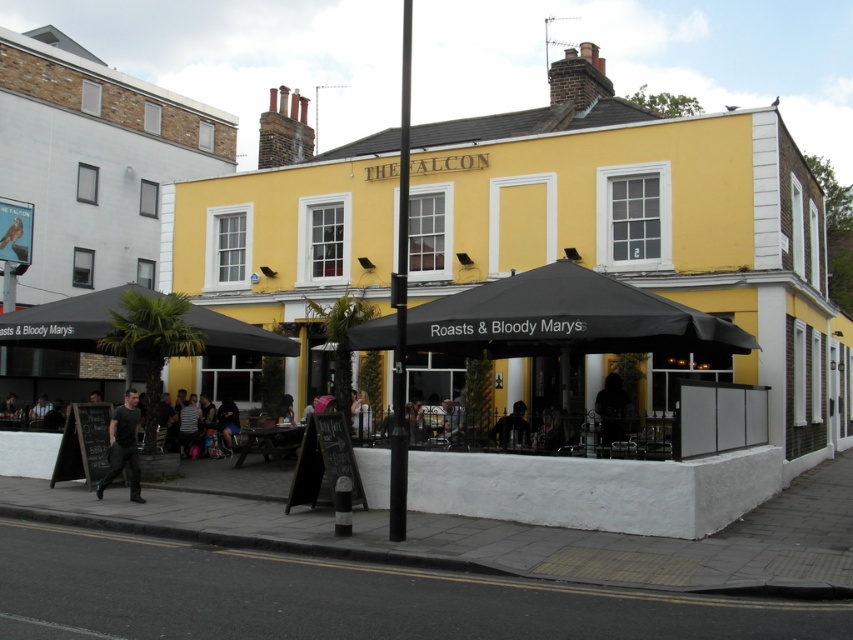
You are a customer waiting to order at THE FALCON. You see the black fabric canopy at center and the dark brown hair at center. Which object is larger in size?

The dark brown hair at center is larger than the black fabric canopy at center.

You are a customer waiting to be seated at THE FALCON. You see the black fabric canopy at center and the dark brown hair at center. Which object is closer to you?

The dark brown hair at center is closer to you because the black fabric canopy at center is located above it.

You are a customer at THE FALCON and want to sit under the black fabric canopy at center. However, you are wearing a black matte shirt at center. Since both are black, will the shirt you are wearing be more visible under the canopy compared to if you were sitting outside of it?

The black fabric canopy at center is narrower than the black matte shirt at center. Since the canopy is narrower, it might not fully cover the shirt, making the shirt more visible when sitting under it compared to being outside where there is no obstruction.